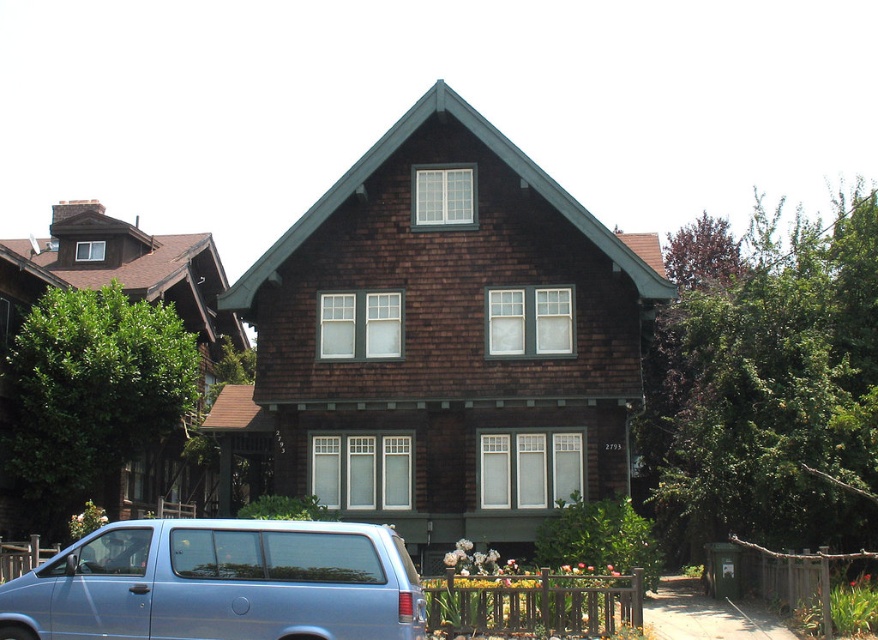
Question: Which object appears farthest from the camera in this image?

Choices:
 (A) metallic blue van at lower left
 (B) brown shingles at center

Answer: (B)

Question: Does brown shingles at center appear over metallic blue van at lower left?

Choices:
 (A) yes
 (B) no

Answer: (A)

Question: Can you confirm if brown shingles at center is positioned above metallic blue van at lower left?

Choices:
 (A) no
 (B) yes

Answer: (B)

Question: Which point is farther to the camera?

Choices:
 (A) metallic blue van at lower left
 (B) brown shingles at center

Answer: (B)

Question: Can you confirm if brown shingles at center is positioned to the right of metallic blue van at lower left?

Choices:
 (A) yes
 (B) no

Answer: (A)

Question: Which object appears closest to the camera in this image?

Choices:
 (A) brown shingles at center
 (B) metallic blue van at lower left

Answer: (B)